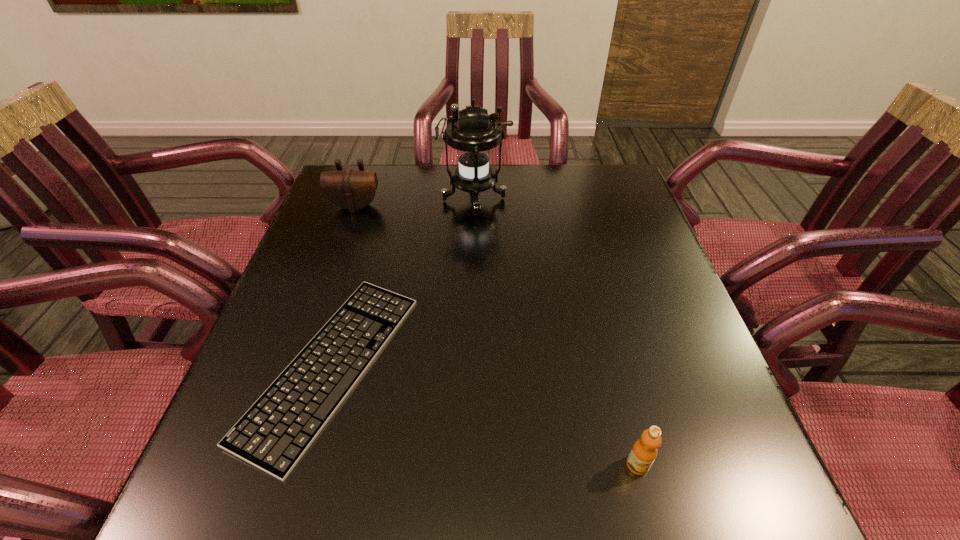
The height and width of the screenshot is (540, 960). In order to click on orange juice located in the near edge section of the desktop in this screenshot , I will do pos(644,451).

The height and width of the screenshot is (540, 960). I want to click on computer keyboard located at the near edge, so click(273, 435).

Where is `pouch at the left edge`? The width and height of the screenshot is (960, 540). pouch at the left edge is located at coordinates (349, 189).

Locate an element on the screen. The width and height of the screenshot is (960, 540). computer keyboard that is at the left edge is located at coordinates (273, 435).

The width and height of the screenshot is (960, 540). Identify the location of object that is at the far left corner. (349, 189).

Locate an element on the screen. The width and height of the screenshot is (960, 540). object positioned at the near left corner is located at coordinates (273, 435).

Find the location of a particular element. This screenshot has width=960, height=540. free space at the far edge of the desktop is located at coordinates (502, 170).

In the image, there is a desktop. Identify the location of vacant space at the near edge. (585, 507).

You are a GUI agent. You are given a task and a screenshot of the screen. Output one action in this format:
    pyautogui.click(x=<x>, y=<y>)
    Task: Click on the vacant space at the left edge of the desktop
    
    Given the screenshot: What is the action you would take?
    pyautogui.click(x=250, y=381)

Image resolution: width=960 pixels, height=540 pixels. Find the location of `free spot at the right edge of the desktop`. free spot at the right edge of the desktop is located at coordinates (663, 280).